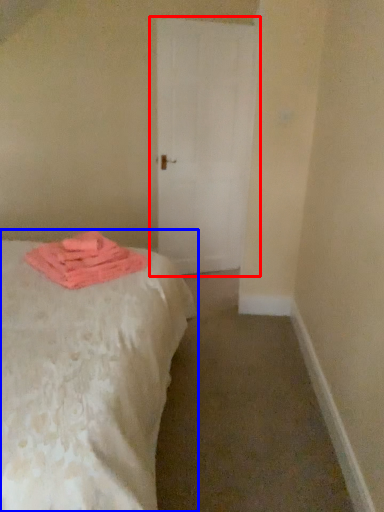
Question: Which point is further to the camera, door (highlighted by a red box) or bed (highlighted by a blue box)?

Choices:
 (A) door
 (B) bed

Answer: (A)